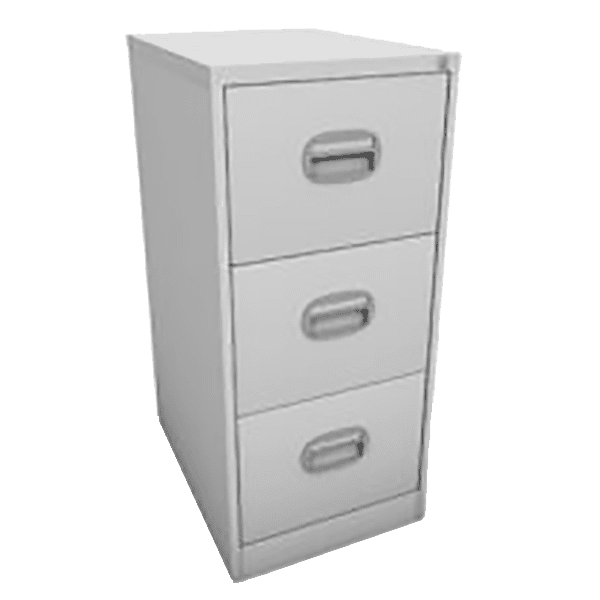
The width and height of the screenshot is (600, 600). What are the coordinates of `middle drawer` in the screenshot? It's located at (256, 381).